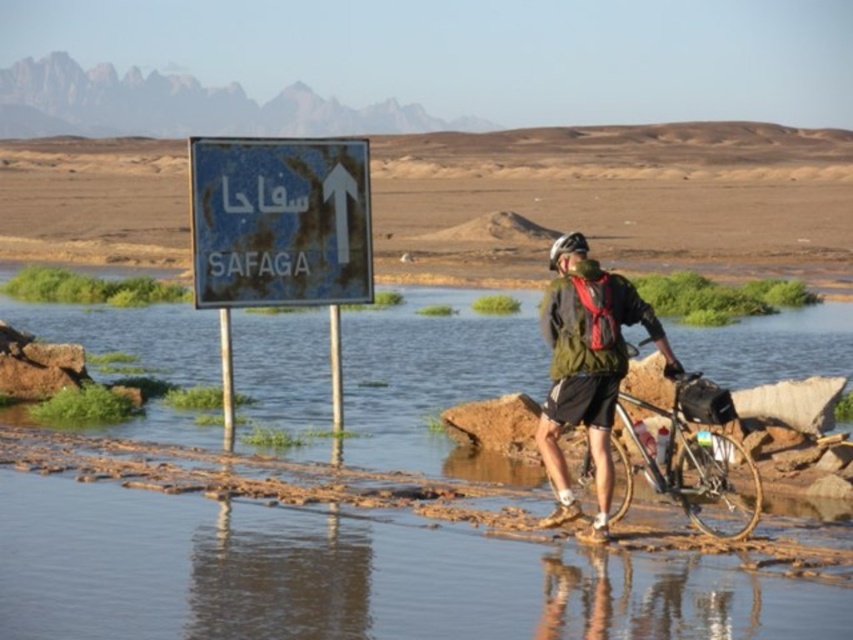
Which is below, green matte jacket at center or white matte bicycle helmet at center?

green matte jacket at center

Is green matte jacket at center above white matte bicycle helmet at center?

Incorrect, green matte jacket at center is not positioned above white matte bicycle helmet at center.

Is point (548, 408) positioned before point (550, 268)?

Yes, point (548, 408) is in front of point (550, 268).

Identify the location of green matte jacket at center. This screenshot has height=640, width=853. (589, 372).

Does blue plastic sign at upper center appear on the left side of shiny metallic bicycle at center?

Yes, blue plastic sign at upper center is to the left of shiny metallic bicycle at center.

Between blue plastic sign at upper center and shiny metallic bicycle at center, which one is positioned lower?

shiny metallic bicycle at center is below.

The height and width of the screenshot is (640, 853). What do you see at coordinates (279, 221) in the screenshot?
I see `blue plastic sign at upper center` at bounding box center [279, 221].

You are a GUI agent. You are given a task and a screenshot of the screen. Output one action in this format:
    pyautogui.click(x=<x>, y=<y>)
    Task: Click on the blue plastic sign at upper center
    The image size is (853, 640).
    Given the screenshot: What is the action you would take?
    pyautogui.click(x=279, y=221)

Describe the element at coordinates (622, 195) in the screenshot. Image resolution: width=853 pixels, height=640 pixels. I see `desert at upper center` at that location.

Is point (776, 211) in front of point (613, 381)?

No, it is behind (613, 381).

Locate an element on the screen. The width and height of the screenshot is (853, 640). desert at upper center is located at coordinates (622, 195).